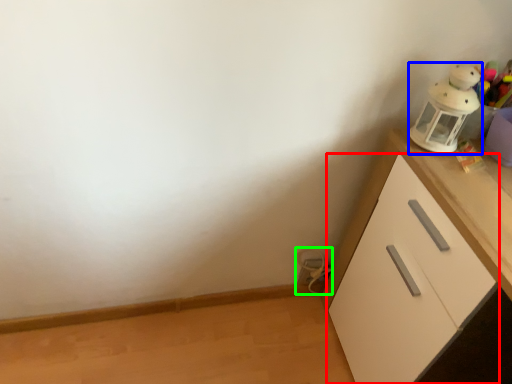
Question: Considering the real-world distances, which object is closest to cabinetry (highlighted by a red box)? toy (highlighted by a blue box) or toy (highlighted by a green box).

Choices:
 (A) toy
 (B) toy

Answer: (A)